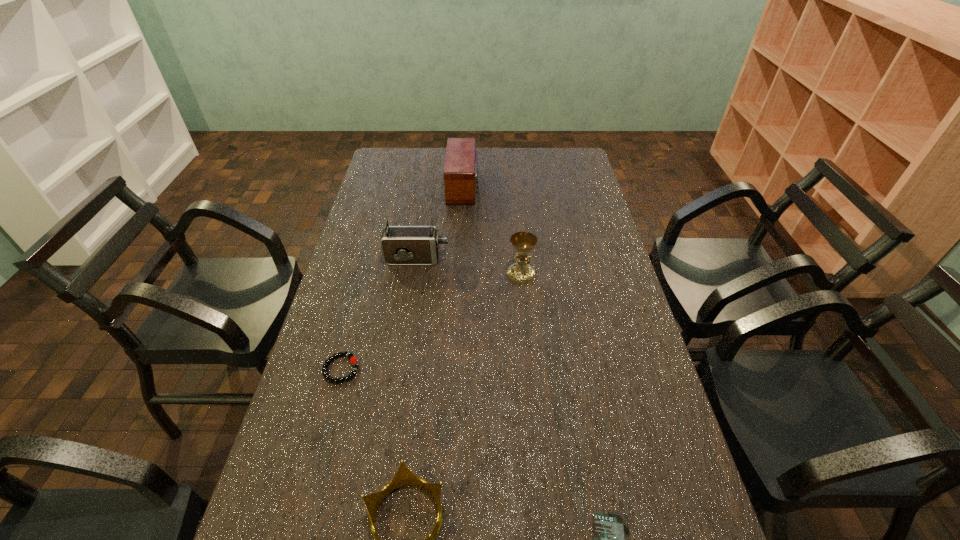
The image size is (960, 540). Identify the location of camcorder present at the left edge. (401, 245).

This screenshot has height=540, width=960. What are the coordinates of `bracelet that is at the left edge` in the screenshot? It's located at (353, 360).

Image resolution: width=960 pixels, height=540 pixels. I want to click on free space at the far edge of the desktop, so click(x=491, y=166).

Find the location of a particular element. The width and height of the screenshot is (960, 540). vacant space at the left edge is located at coordinates (371, 305).

Find the location of `free space at the right edge`. free space at the right edge is located at coordinates (608, 346).

This screenshot has height=540, width=960. In the image, there is a desktop. Identify the location of vacant space at the far left corner. (399, 160).

The image size is (960, 540). In the image, there is a desktop. Identify the location of free space at the far right corner. (554, 167).

Find the location of a particular element. The image size is (960, 540). vacant space that's between the bracelet and the camcorder is located at coordinates click(379, 314).

Where is `vacant area that lies between the chalice and the bracelet`? vacant area that lies between the chalice and the bracelet is located at coordinates (431, 321).

You are a GUI agent. You are given a task and a screenshot of the screen. Output one action in this format:
    pyautogui.click(x=<x>, y=<y>)
    Task: Click on the second closest object to the farthest object
    The image size is (960, 540).
    Given the screenshot: What is the action you would take?
    (x=523, y=243)